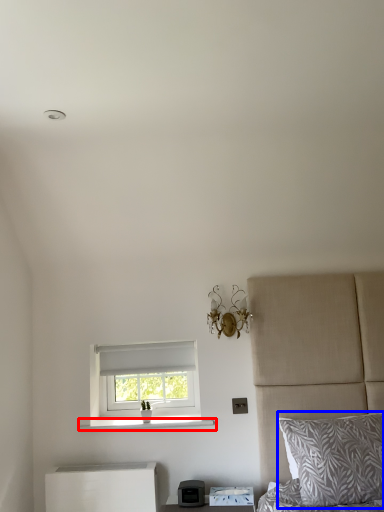
Question: Which of the following is the farthest to the observer, window sill (highlighted by a red box) or pillow (highlighted by a blue box)?

Choices:
 (A) window sill
 (B) pillow

Answer: (A)